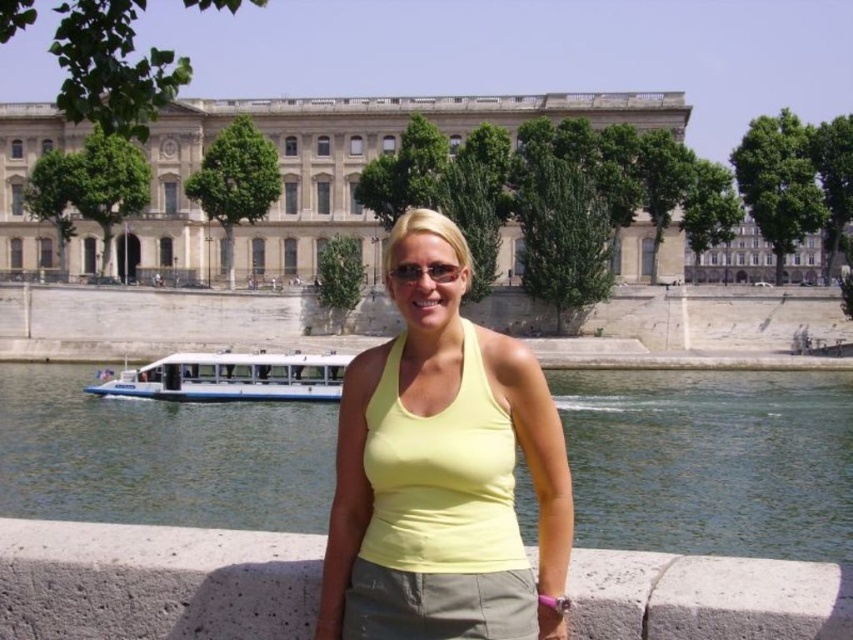
You are a photographer taking a picture of the white matte boat at lower left and the matte black sunglasses at center. Which object is closer to the camera?

The white matte boat at lower left is closer to the camera because the matte black sunglasses at center is behind it.

You are a photographer trying to capture the woman in the scene. You notice the yellow matte tank top at center is exactly at point (442, 452). If you want to frame your shot so that the tank top is at the center, where should you position your camera?

Position the camera so that the yellow matte tank top at center is centered at point (442, 452).